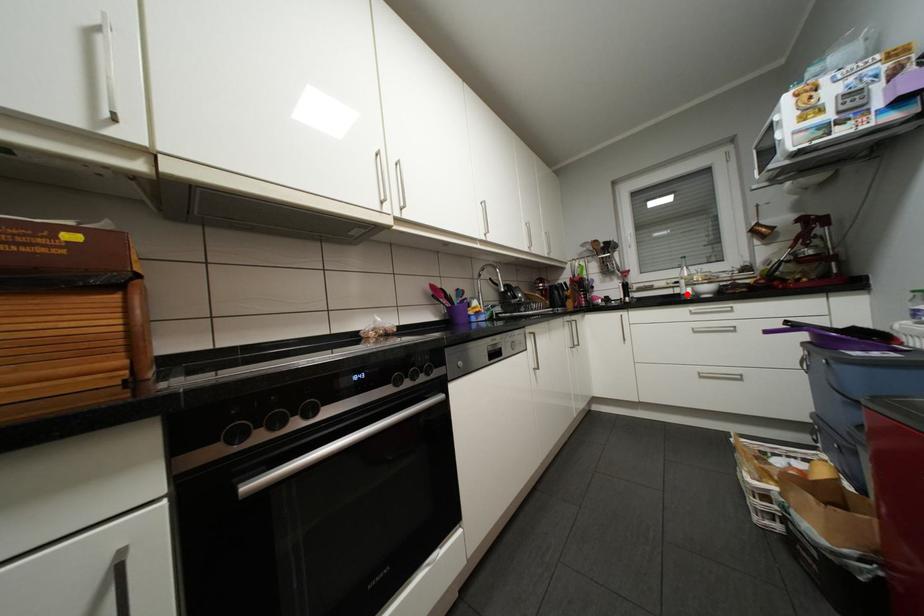
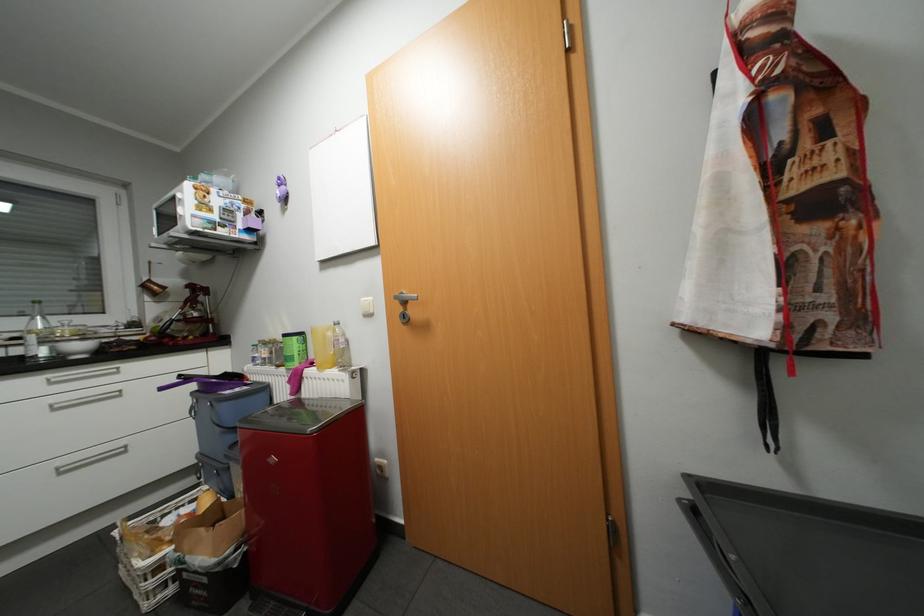
Find the pixel in the second image that matches the highlighted location in the first image.

(30, 357)